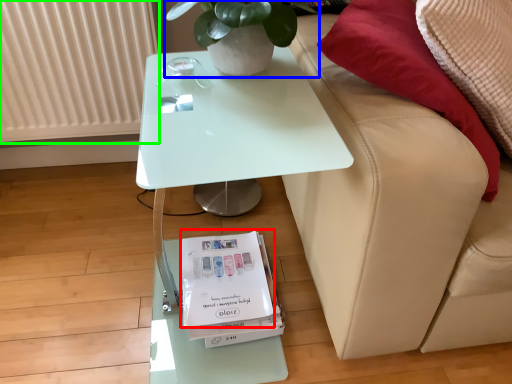
Question: Which is farther away from magazine (highlighted by a red box)? houseplant (highlighted by a blue box) or radiator (highlighted by a green box)?

Choices:
 (A) houseplant
 (B) radiator

Answer: (B)